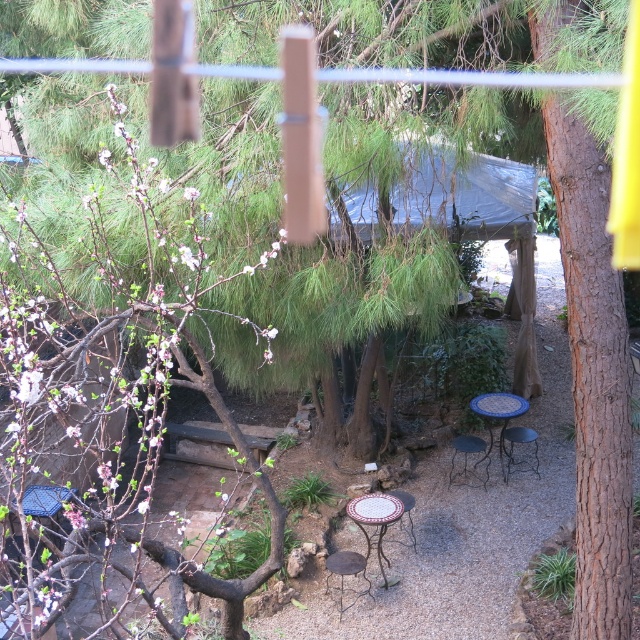
Does metallic mosaic table at center appear under metallic stool at center?

Actually, metallic mosaic table at center is above metallic stool at center.

Who is lower down, metallic mosaic table at center or metallic stool at center?

metallic stool at center is lower down.

Locate an element on the screen. metallic mosaic table at center is located at coordinates (465, 456).

Where is `metallic mosaic table at center`? metallic mosaic table at center is located at coordinates (465, 456).

Who is lower down, metallic stool at center or metallic black chair at center?

metallic stool at center

Does metallic stool at center appear on the right side of metallic black chair at center?

In fact, metallic stool at center is to the left of metallic black chair at center.

Who is more distant from viewer, (353, 564) or (536, 458)?

Point (536, 458)

Identify the location of metallic stool at center. (346, 566).

Can you confirm if brown rough bark tree at right is wider than porcelain ceramic table at center?

Yes, brown rough bark tree at right is wider than porcelain ceramic table at center.

Who is lower down, brown rough bark tree at right or porcelain ceramic table at center?

porcelain ceramic table at center is below.

I want to click on brown rough bark tree at right, so click(593, 376).